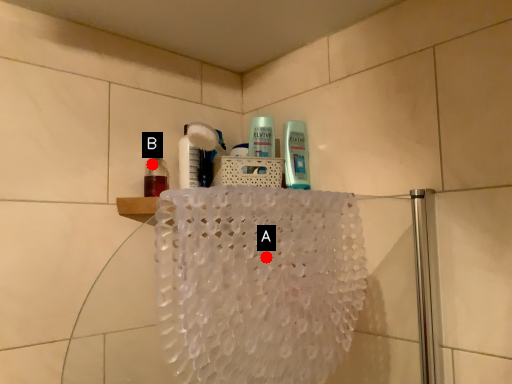
Question: Two points are circled on the image, labeled by A and B beside each circle. Among these points, which one is farthest from the camera?

Choices:
 (A) A is further
 (B) B is further

Answer: (B)